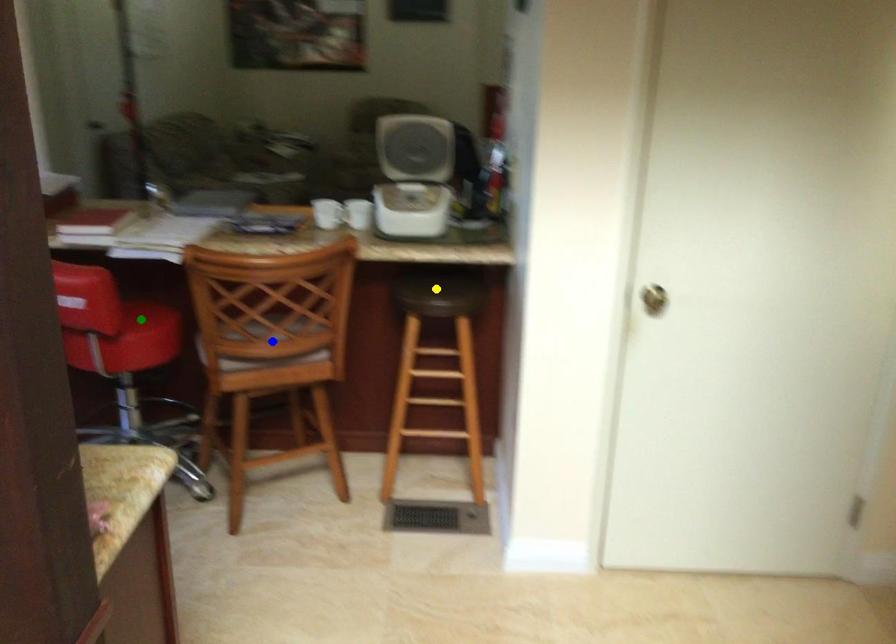
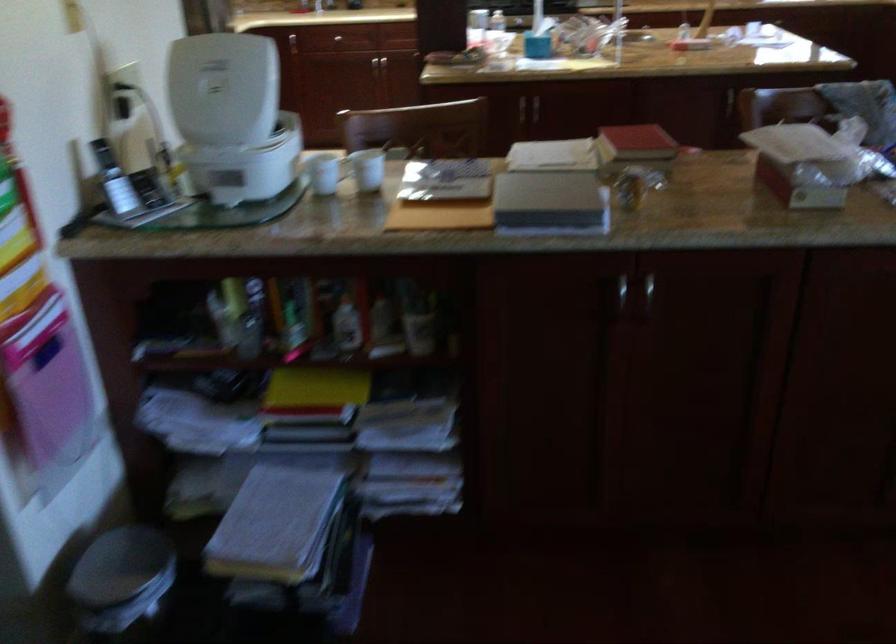
I am providing you with two images of the same scene from different viewpoints. Three points are marked in image1. Which point corresponds to a part or object that is occluded in image2?In image1, three points are marked. Which of them correspond to a part or object that is occluded in image2?Among the three points shown in image1, which one corresponds to a part or object that is no longer visible due to occlusion in image2?

Invisible in image2: yellow point, blue point, green point.